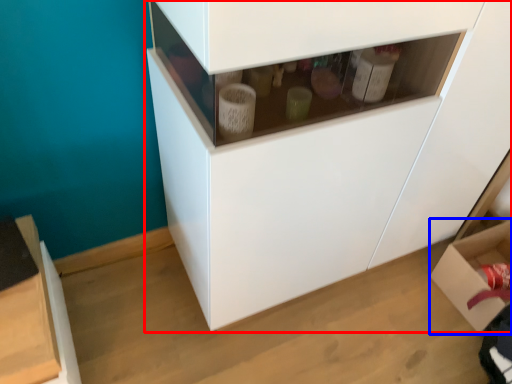
Question: Which object is further to the camera taking this photo, cabinetry (highlighted by a red box) or cardboard box (highlighted by a blue box)?

Choices:
 (A) cabinetry
 (B) cardboard box

Answer: (B)